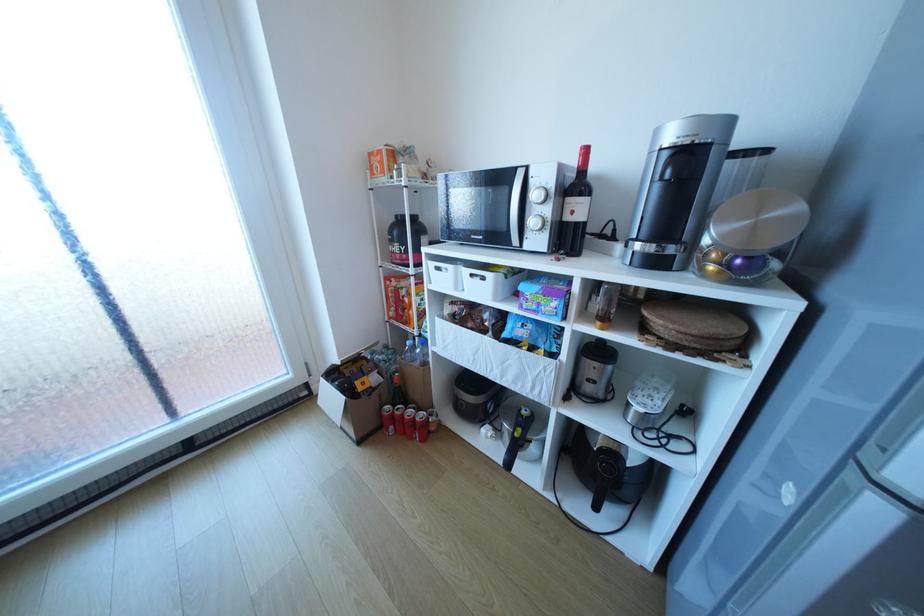
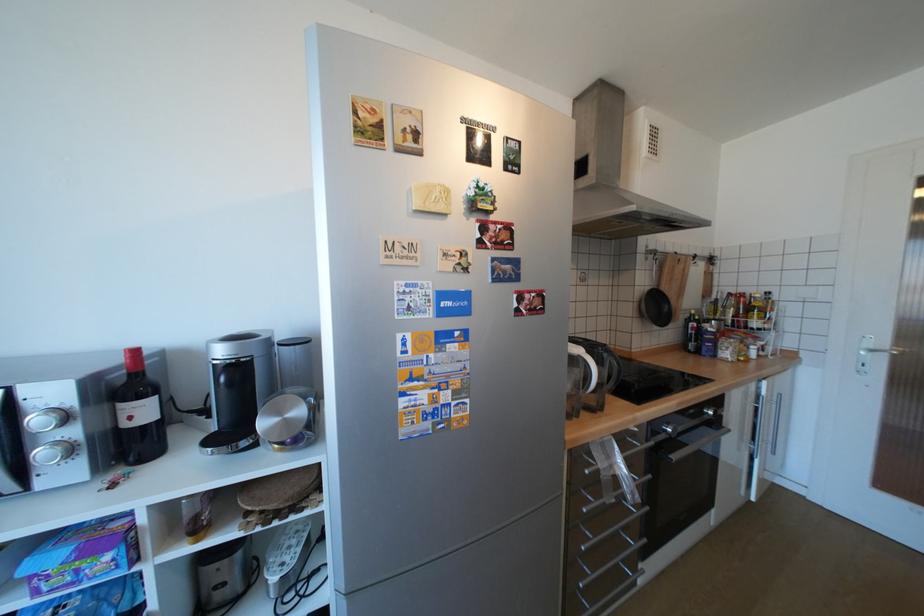
Locate, in the second image, the point that corresponds to point (541, 222) in the first image.

(52, 453)